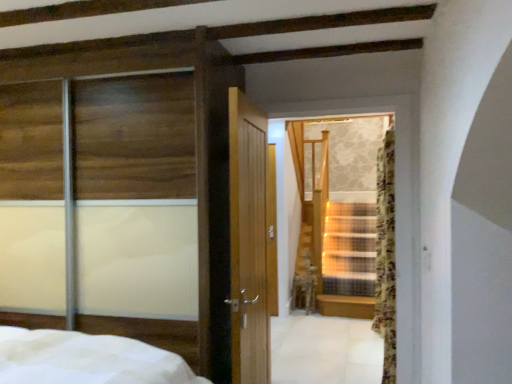
Question: In terms of size, does transparent glass stairs at center appear bigger or smaller than floral fabric curtain at right?

Choices:
 (A) small
 (B) big

Answer: (B)

Question: From a real-world perspective, relative to floral fabric curtain at right, is transparent glass stairs at center vertically above or below?

Choices:
 (A) above
 (B) below

Answer: (A)

Question: Which object is the farthest from the floral fabric curtain at right?

Choices:
 (A) transparent glass stairs at center
 (B) transparent glass sliding door at left

Answer: (B)

Question: Estimate the real-world distances between objects in this image. Which object is farther from the transparent glass sliding door at left?

Choices:
 (A) transparent glass stairs at center
 (B) floral fabric curtain at right

Answer: (B)